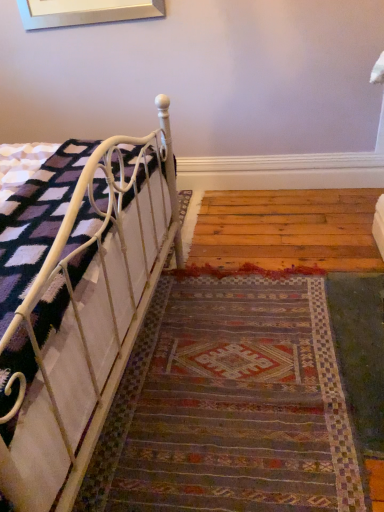
Question: From a real-world perspective, is multicolored woven rug at center located higher than white metal bed at left?

Choices:
 (A) yes
 (B) no

Answer: (B)

Question: Is multicolored woven rug at center taller than white metal bed at left?

Choices:
 (A) yes
 (B) no

Answer: (B)

Question: From the image's perspective, does multicolored woven rug at center appear higher than white metal bed at left?

Choices:
 (A) no
 (B) yes

Answer: (A)

Question: Is multicolored woven rug at center facing away from white metal bed at left?

Choices:
 (A) no
 (B) yes

Answer: (A)

Question: Is multicolored woven rug at center smaller than white metal bed at left?

Choices:
 (A) no
 (B) yes

Answer: (B)

Question: Is multicolored woven rug at center thinner than white metal bed at left?

Choices:
 (A) yes
 (B) no

Answer: (B)

Question: Can you confirm if white metal bed at left is bigger than multicolored woven rug at center?

Choices:
 (A) no
 (B) yes

Answer: (B)

Question: Is multicolored woven rug at center surrounded by white metal bed at left?

Choices:
 (A) no
 (B) yes

Answer: (A)

Question: Considering the relative sizes of white metal bed at left and multicolored woven rug at center in the image provided, is white metal bed at left taller than multicolored woven rug at center?

Choices:
 (A) yes
 (B) no

Answer: (A)

Question: Can you confirm if white metal bed at left is smaller than multicolored woven rug at center?

Choices:
 (A) yes
 (B) no

Answer: (B)

Question: From a real-world perspective, is white metal bed at left located beneath multicolored woven rug at center?

Choices:
 (A) yes
 (B) no

Answer: (B)

Question: Is white metal bed at left wider than multicolored woven rug at center?

Choices:
 (A) yes
 (B) no

Answer: (B)

Question: Relative to multicolored woven rug at center, is white metal bed at left in front or behind?

Choices:
 (A) front
 (B) behind

Answer: (A)